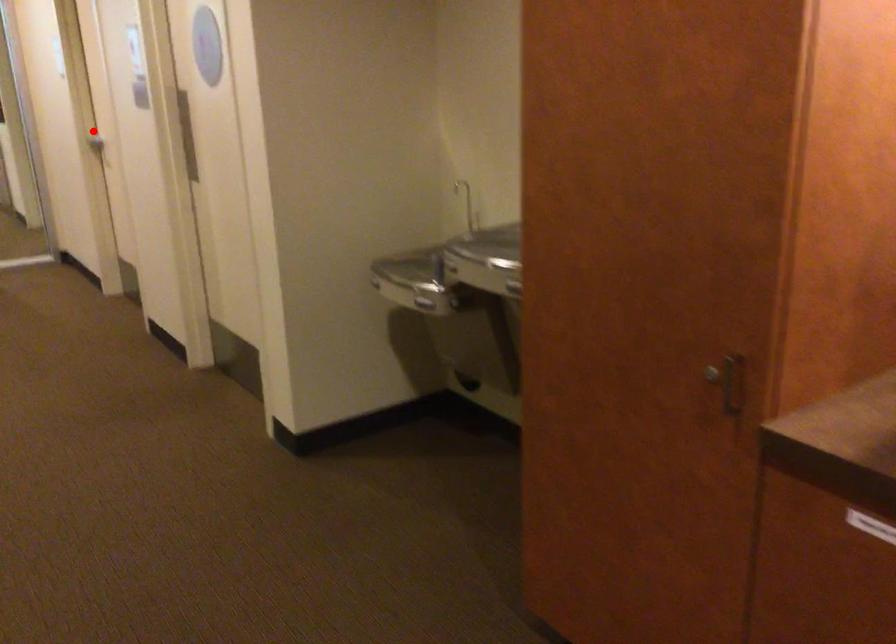
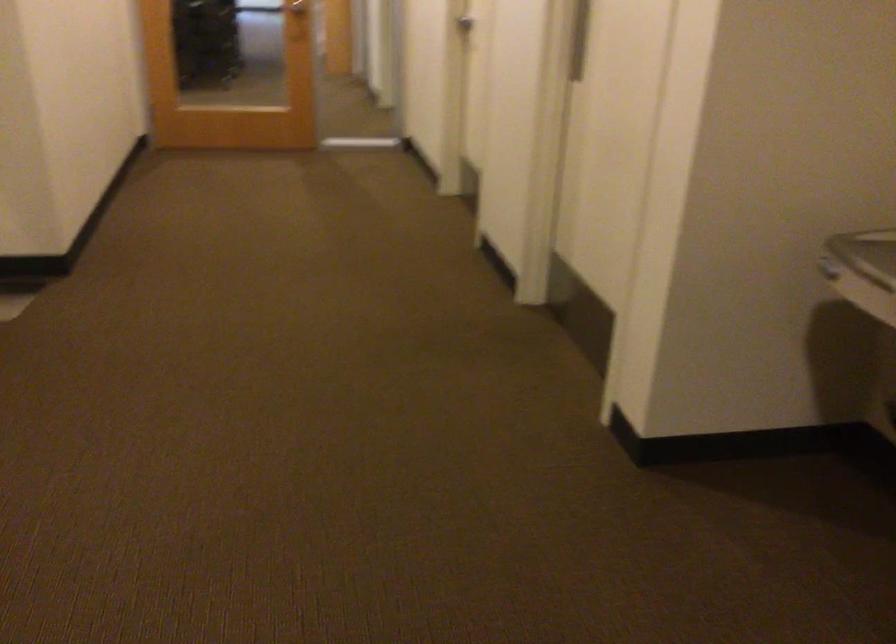
Where in the second image is the point corresponding to the highlighted location from the first image?

(464, 23)